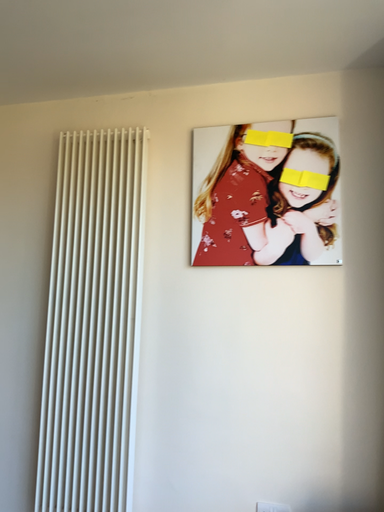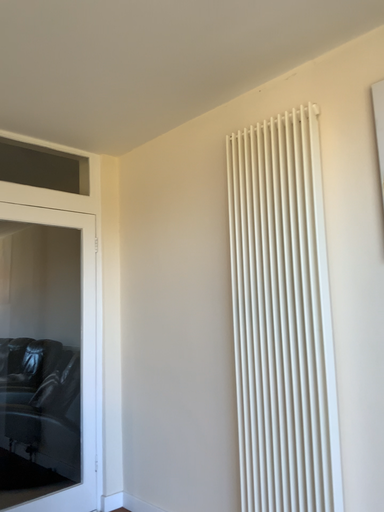
Question: Which way did the camera rotate in the video?

Choices:
 (A) rotated right
 (B) rotated left

Answer: (B)